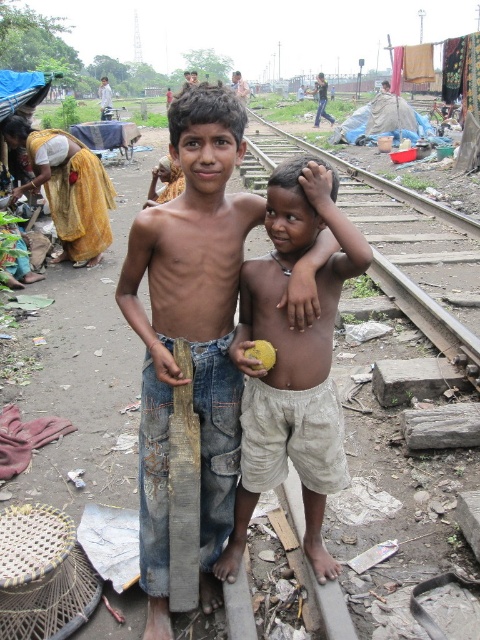
Question: Which object is the farthest from the yellow cotton sari at upper left?

Choices:
 (A) wooden plank at center
 (B) metal train track at center
 (C) light beige shorts at center

Answer: (C)

Question: Which point is farther to the camera?

Choices:
 (A) metal train track at center
 (B) yellow cotton sari at upper left
 (C) wooden plank at center

Answer: (B)

Question: Is light beige shorts at center to the left of yellow cotton sari at upper left from the viewer's perspective?

Choices:
 (A) no
 (B) yes

Answer: (A)

Question: Estimate the real-world distances between objects in this image. Which object is farther from the wooden plank at center?

Choices:
 (A) light beige shorts at center
 (B) metal train track at center
 (C) yellow cotton sari at upper left

Answer: (B)

Question: Can you confirm if metal train track at center is bigger than yellow cotton sari at upper left?

Choices:
 (A) yes
 (B) no

Answer: (A)

Question: Is metal train track at center bigger than yellow cotton sari at upper left?

Choices:
 (A) yes
 (B) no

Answer: (A)